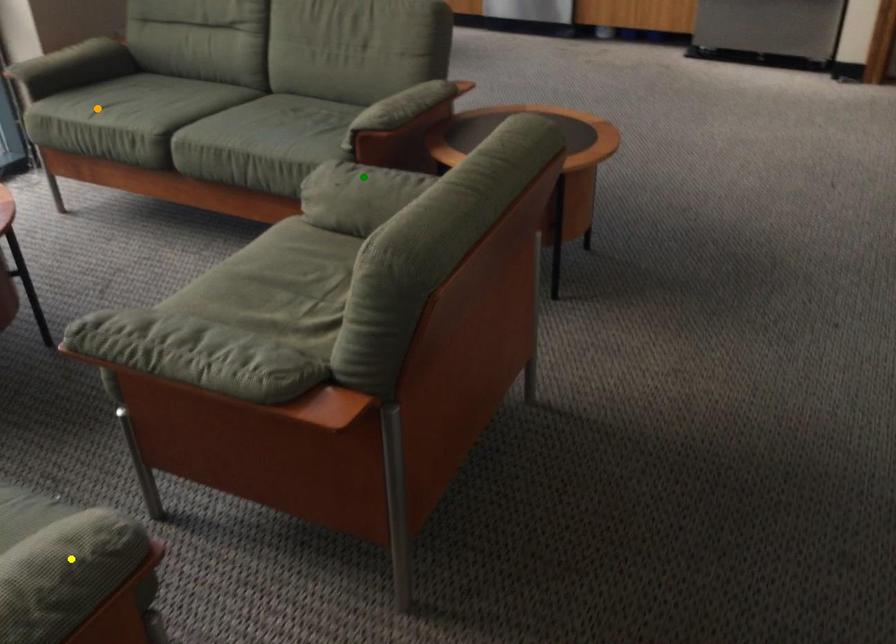
Order these from nearest to farthest:
A) orange point
B) yellow point
C) green point

yellow point
green point
orange point